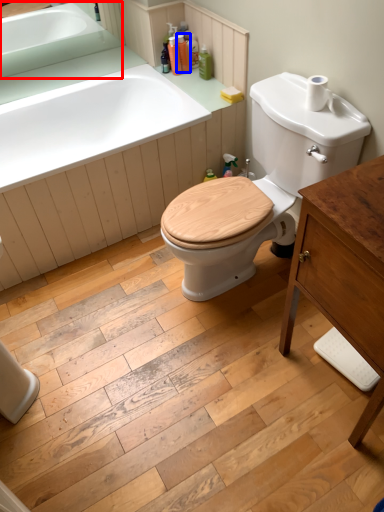
Question: Among these objects, which one is nearest to the camera, sink (highlighted by a red box) or toiletry (highlighted by a blue box)?

Choices:
 (A) sink
 (B) toiletry

Answer: (A)